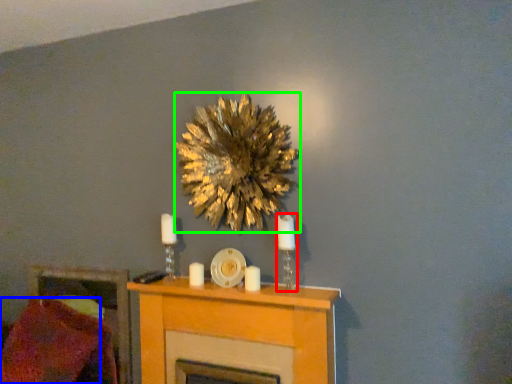
Question: Considering the real-world distances, which object is farthest from candle holder (highlighted by a red box)? pillow (highlighted by a blue box) or flower (highlighted by a green box)?

Choices:
 (A) pillow
 (B) flower

Answer: (A)